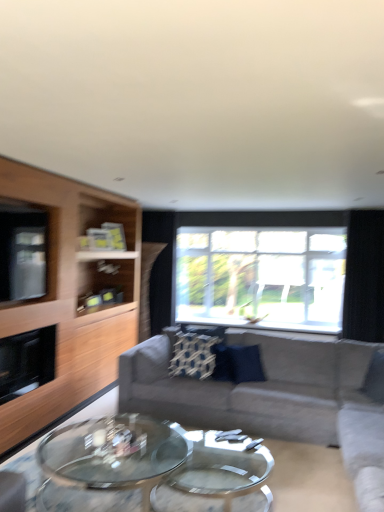
Question: In the image, is light wood entertainment center at left positioned in front of or behind transparent glass coffee table at center?

Choices:
 (A) behind
 (B) front

Answer: (A)

Question: From the image's perspective, is light wood entertainment center at left positioned above or below transparent glass coffee table at center?

Choices:
 (A) above
 (B) below

Answer: (A)

Question: Which object is positioned closest to the transparent glass window at center?

Choices:
 (A) black fabric curtain at right
 (B) clear glass window screen at left
 (C) transparent glass coffee table at center
 (D) gray fabric couch at center
 (E) navy blue fabric pillow at center

Answer: (A)

Question: Which object is positioned closest to the light wood entertainment center at left?

Choices:
 (A) clear glass window screen at left
 (B) transparent glass window at center
 (C) black fabric curtain at right
 (D) transparent glass coffee table at center
 (E) navy blue fabric pillow at center

Answer: (A)